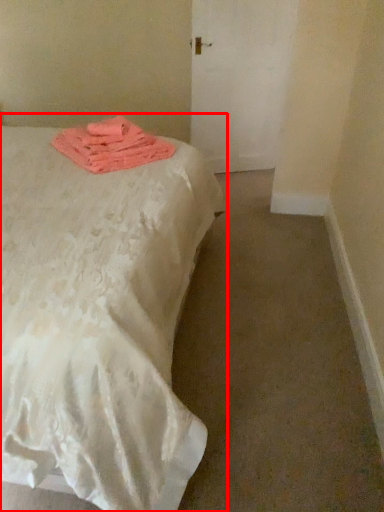
Question: In this image, where is bed (annotated by the red box) located relative to cloth?

Choices:
 (A) left
 (B) right

Answer: (A)